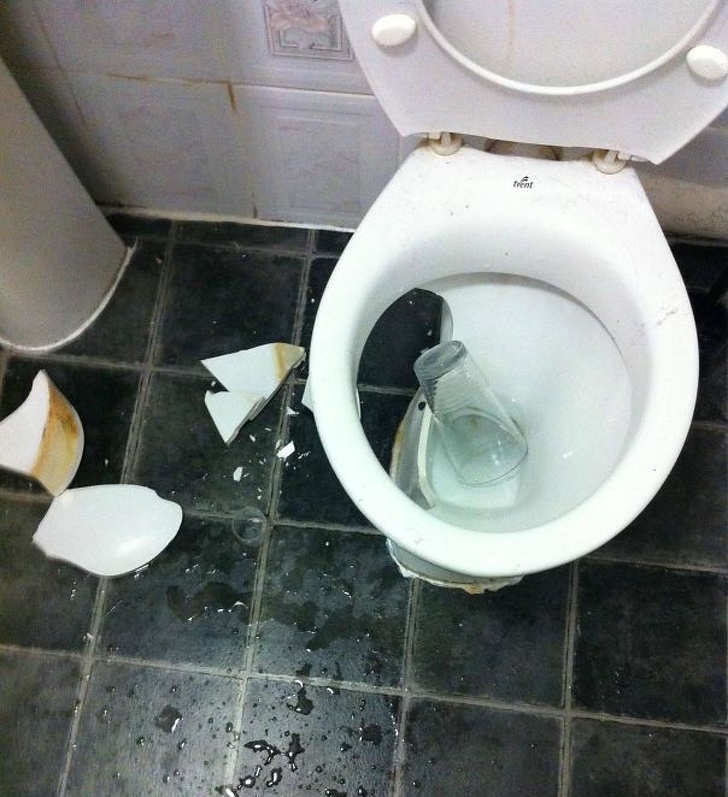
In order to click on wall in this screenshot , I will do `click(178, 68)`.